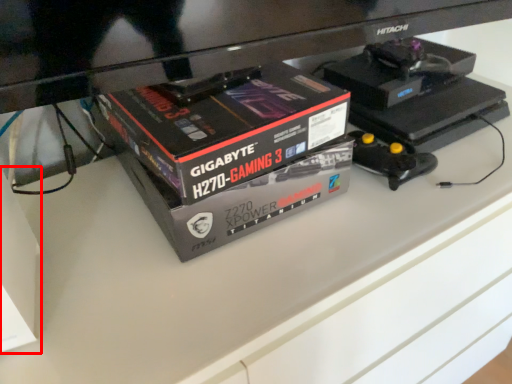
Question: In this image, where is box (annotated by the red box) located relative to box?

Choices:
 (A) right
 (B) left

Answer: (B)